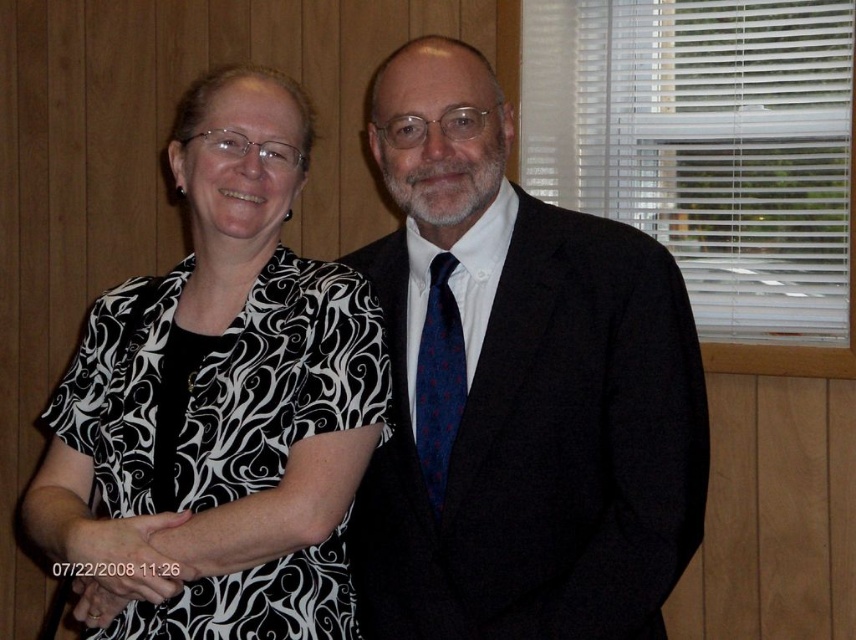
Which is in front, point (553, 515) or point (263, 106)?

Point (553, 515) is more forward.

Does dark blue textured suit at center appear over black and white printed blouse at left?

No, dark blue textured suit at center is not above black and white printed blouse at left.

I want to click on dark blue textured suit at center, so click(516, 388).

Between black and white printed blouse at left and blue dotted fabric tie at center, which one has more height?

Standing taller between the two is black and white printed blouse at left.

Can you confirm if black and white printed blouse at left is positioned to the left of blue dotted fabric tie at center?

Yes, black and white printed blouse at left is to the left of blue dotted fabric tie at center.

Between point (373, 307) and point (444, 344), which one is positioned behind?

Positioned behind is point (444, 344).

Locate an element on the screen. Image resolution: width=856 pixels, height=640 pixels. black and white printed blouse at left is located at coordinates (218, 404).

Which of these two, dark blue textured suit at center or blue dotted fabric tie at center, stands shorter?

Standing shorter between the two is blue dotted fabric tie at center.

Which is more to the left, dark blue textured suit at center or blue dotted fabric tie at center?

blue dotted fabric tie at center is more to the left.

What do you see at coordinates (516, 388) in the screenshot?
I see `dark blue textured suit at center` at bounding box center [516, 388].

Where is `dark blue textured suit at center`? This screenshot has height=640, width=856. dark blue textured suit at center is located at coordinates (516, 388).